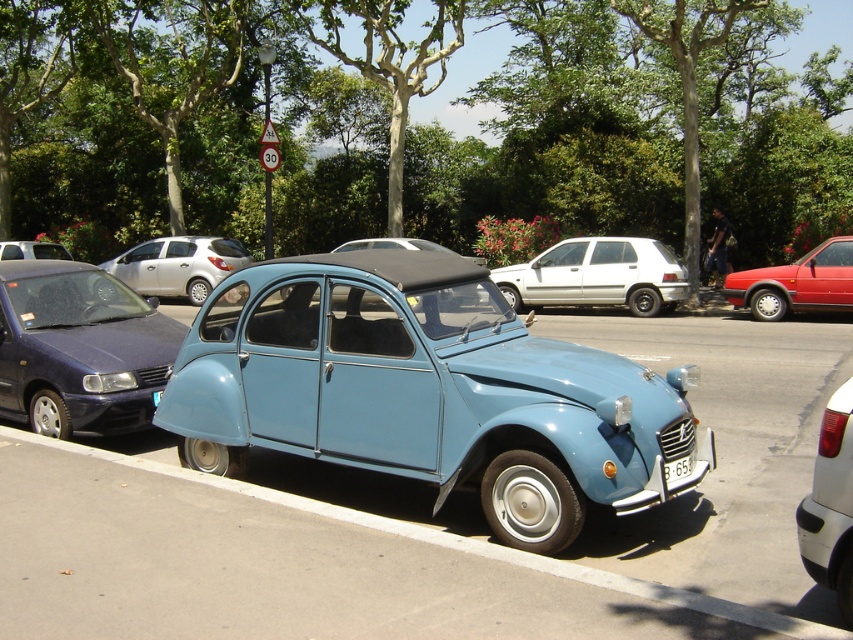
Is light blue metallic car at center to the right of matte black car at left from the viewer's perspective?

Yes, light blue metallic car at center is to the right of matte black car at left.

Identify the location of light blue metallic car at center. (426, 392).

Find the location of a particular element. The width and height of the screenshot is (853, 640). light blue metallic car at center is located at coordinates (426, 392).

Who is positioned more to the right, white glossy tail light at lower right or white plastic license plate at lower center?

white glossy tail light at lower right

Which is below, white glossy tail light at lower right or white plastic license plate at lower center?

Positioned lower is white plastic license plate at lower center.

Who is more forward, (816, 461) or (677, 461)?

Point (816, 461) is more forward.

In order to click on white glossy tail light at lower right in this screenshot , I will do `click(830, 502)`.

Between matte black car at left and white plastic license plate at lower center, which one has more height?

With more height is matte black car at left.

Is point (22, 252) less distant than point (685, 460)?

No.

Locate an element on the screen. This screenshot has width=853, height=640. matte black car at left is located at coordinates (32, 250).